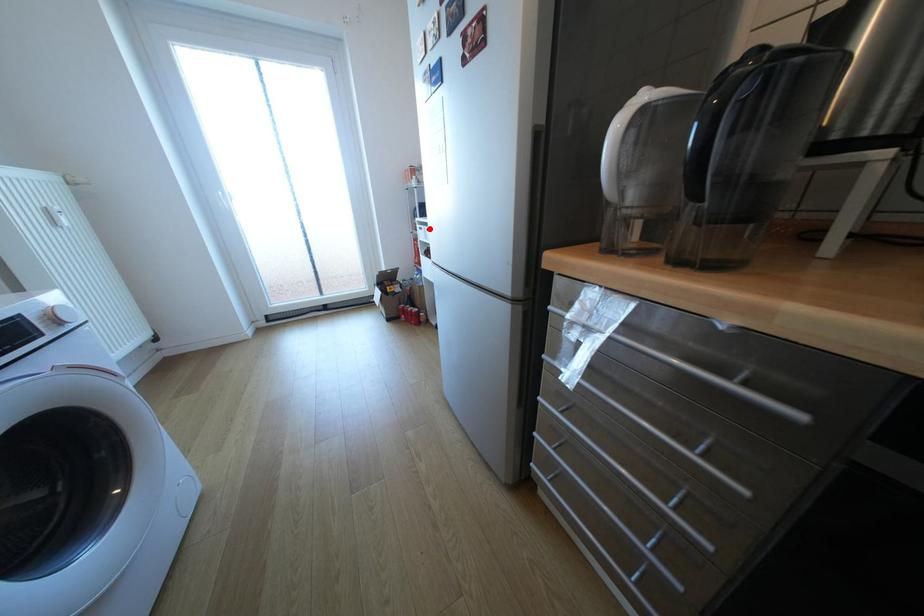
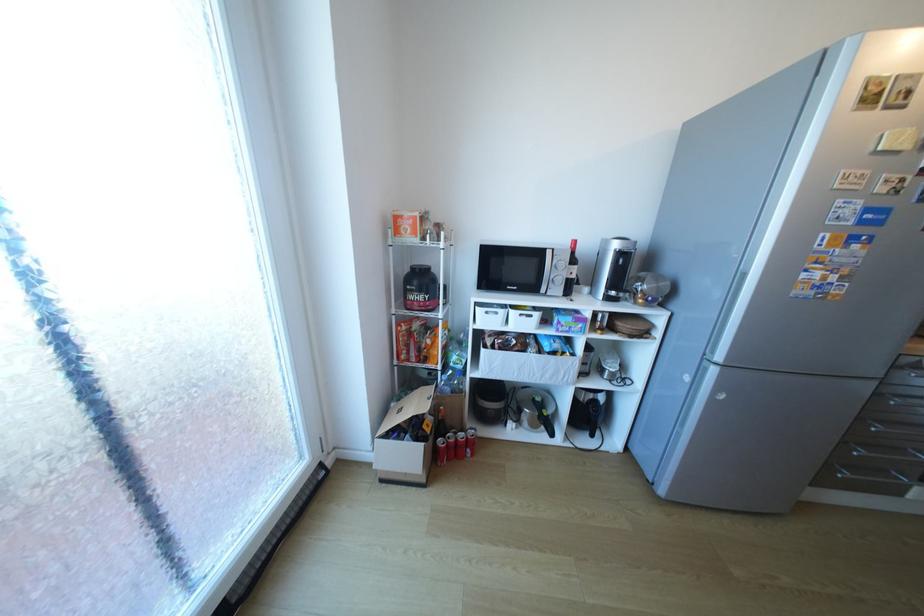
Locate, in the second image, the point that corresponds to the highlighted location in the first image.

(495, 313)